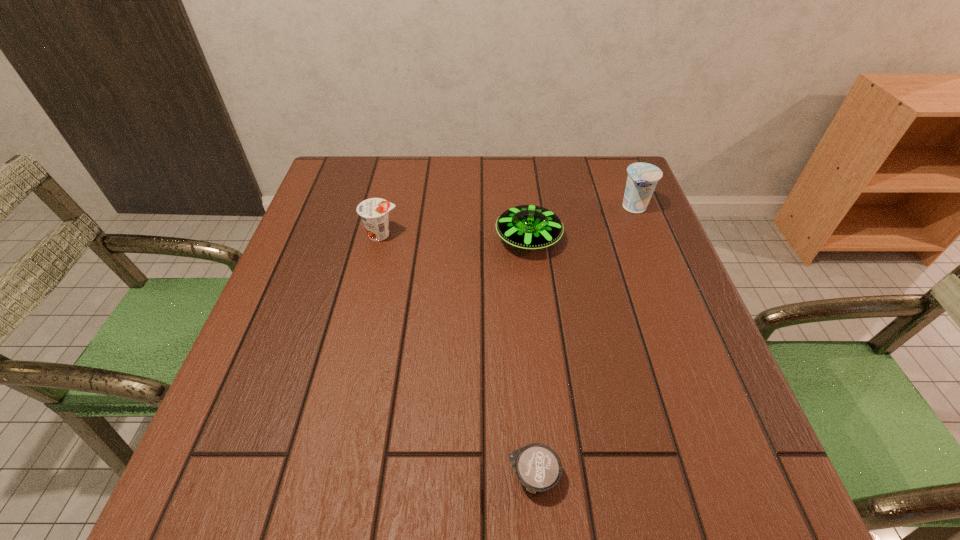
Locate an element on the screen. The image size is (960, 540). vacant space at the near right corner of the desktop is located at coordinates (704, 451).

The height and width of the screenshot is (540, 960). I want to click on vacant area that lies between the saucer and the second yogurt from right to left, so click(531, 358).

Image resolution: width=960 pixels, height=540 pixels. Find the location of `unoccupied position between the second nearest yogurt and the saucer`. unoccupied position between the second nearest yogurt and the saucer is located at coordinates (455, 237).

Identify the location of free space between the shortest object and the saucer. (531, 358).

The image size is (960, 540). Find the location of `free space between the saucer and the shortest object`. free space between the saucer and the shortest object is located at coordinates (531, 358).

The height and width of the screenshot is (540, 960). What are the coordinates of `unoccupied area between the nearest yogurt and the tallest yogurt` in the screenshot? It's located at (584, 342).

Locate an element on the screen. free space between the saucer and the tallest object is located at coordinates (582, 224).

At what (x,y) coordinates should I click in order to perform the action: click on empty space between the rightmost yogurt and the saucer. Please return your answer as a coordinate pair (x, y). This screenshot has width=960, height=540. Looking at the image, I should click on (582, 224).

The image size is (960, 540). I want to click on free space that is in between the nearest object and the farthest object, so click(x=584, y=342).

At what (x,y) coordinates should I click in order to perform the action: click on free area in between the nearest object and the farthest object. Please return your answer as a coordinate pair (x, y). Looking at the image, I should click on (x=584, y=342).